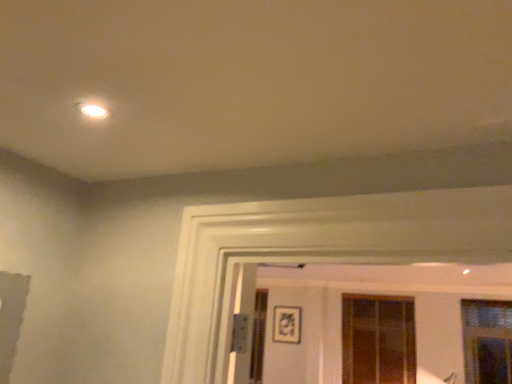
Question: From a real-world perspective, does matte black picture frame at center sit lower than clear glass window at right, the 2th window from the left?

Choices:
 (A) yes
 (B) no

Answer: (B)

Question: Does matte black picture frame at center have a larger size compared to clear glass window at right, the 2th window from the left?

Choices:
 (A) no
 (B) yes

Answer: (A)

Question: From the image's perspective, is matte black picture frame at center beneath clear glass window at right, the 2th window from the left?

Choices:
 (A) yes
 (B) no

Answer: (A)

Question: Is clear glass window at right, the 2th window from the left, at the back of matte black picture frame at center?

Choices:
 (A) yes
 (B) no

Answer: (B)

Question: Is matte black picture frame at center not close to clear glass window at right, arranged as the 2th window when viewed from the back?

Choices:
 (A) no
 (B) yes

Answer: (B)

Question: Would you say clear glass window at right, arranged as the 2th window when viewed from the back, is to the left or to the right of translucent glass window at center, which ranks as the first window in left-to-right order, in the picture?

Choices:
 (A) right
 (B) left

Answer: (A)

Question: Looking at the image, does clear glass window at right, which is counted as the 1th window, starting from the right, seem bigger or smaller compared to translucent glass window at center, the second window viewed from the front?

Choices:
 (A) small
 (B) big

Answer: (A)

Question: Considering the positions of clear glass window at right, the first window viewed from the front, and translucent glass window at center, arranged as the first window when viewed from the back, in the image, is clear glass window at right, the first window viewed from the front, taller or shorter than translucent glass window at center, arranged as the first window when viewed from the back,?

Choices:
 (A) short
 (B) tall

Answer: (A)

Question: Is clear glass window at right, which is counted as the 1th window, starting from the right, inside or outside of translucent glass window at center, arranged as the first window when viewed from the back?

Choices:
 (A) outside
 (B) inside

Answer: (A)

Question: From the image's perspective, is clear glass window at right, which is counted as the 1th window, starting from the right, positioned above or below matte black picture frame at center?

Choices:
 (A) above
 (B) below

Answer: (A)

Question: Based on their sizes in the image, would you say clear glass window at right, the 2th window from the left, is bigger or smaller than matte black picture frame at center?

Choices:
 (A) big
 (B) small

Answer: (A)

Question: In terms of width, does clear glass window at right, arranged as the 2th window when viewed from the back, look wider or thinner when compared to matte black picture frame at center?

Choices:
 (A) thin
 (B) wide

Answer: (B)

Question: Relative to matte black picture frame at center, is clear glass window at right, the 2th window from the left, in front or behind?

Choices:
 (A) front
 (B) behind

Answer: (A)

Question: Considering their positions, is matte black picture frame at center located in front of or behind translucent glass window at center, arranged as the first window when viewed from the back?

Choices:
 (A) behind
 (B) front

Answer: (A)

Question: From a real-world perspective, relative to translucent glass window at center, which ranks as the first window in left-to-right order, is matte black picture frame at center vertically above or below?

Choices:
 (A) above
 (B) below

Answer: (A)